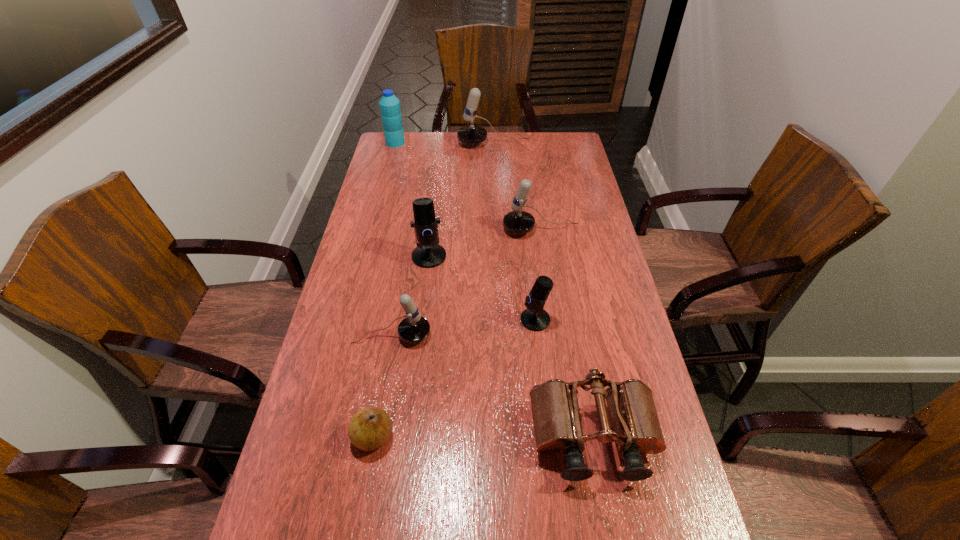
Image resolution: width=960 pixels, height=540 pixels. In the image, there is a desktop. In order to click on vacant space at the far edge in this screenshot , I will do `click(460, 155)`.

In the image, there is a desktop. Identify the location of free space at the left edge. The height and width of the screenshot is (540, 960). (294, 465).

Image resolution: width=960 pixels, height=540 pixels. In the image, there is a desktop. In order to click on free region at the right edge in this screenshot , I will do `click(623, 380)`.

You are a GUI agent. You are given a task and a screenshot of the screen. Output one action in this format:
    pyautogui.click(x=<x>, y=<y>)
    Task: Click on the vacant area at the far right corner
    This screenshot has width=960, height=540.
    Given the screenshot: What is the action you would take?
    pyautogui.click(x=542, y=152)

This screenshot has width=960, height=540. What are the coordinates of `unoccupied position between the second biggest white microphone and the fifth nearest object` in the screenshot? It's located at (485, 243).

Where is `empty space that is in between the smaller black microphone and the binoculars`? This screenshot has height=540, width=960. empty space that is in between the smaller black microphone and the binoculars is located at coordinates pyautogui.click(x=564, y=379).

Identify the location of blank region between the brown pear and the second farthest white microphone. Image resolution: width=960 pixels, height=540 pixels. (457, 333).

Find the location of a particular element. This screenshot has width=960, height=540. free space that is in between the binoculars and the bigger black microphone is located at coordinates (511, 347).

Where is `vacant space in between the binoculars and the leftmost white microphone`? The width and height of the screenshot is (960, 540). vacant space in between the binoculars and the leftmost white microphone is located at coordinates (492, 387).

The height and width of the screenshot is (540, 960). In order to click on vacant space in between the blue water bottle and the binoculars in this screenshot , I will do `click(494, 290)`.